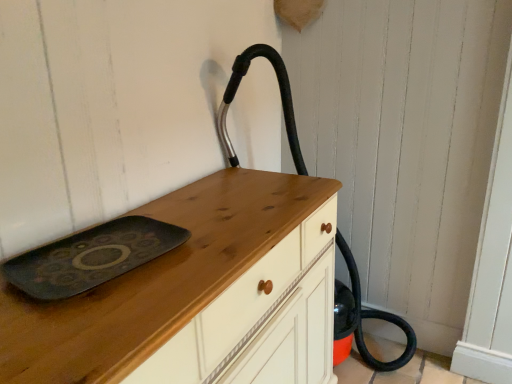
Question: From the image's perspective, relative to black rubber hose at center, is matte black tray at center above or below?

Choices:
 (A) below
 (B) above

Answer: (A)

Question: In terms of width, does matte black tray at center look wider or thinner when compared to black rubber hose at center?

Choices:
 (A) thin
 (B) wide

Answer: (A)

Question: Which of these objects is positioned farthest from the wooden chest of drawers at center?

Choices:
 (A) matte black tray at center
 (B) black rubber hose at center

Answer: (B)

Question: Which is nearer to the black rubber hose at center?

Choices:
 (A) matte black tray at center
 (B) wooden chest of drawers at center

Answer: (B)